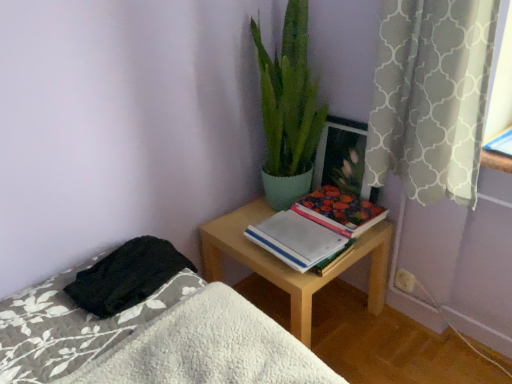
Question: From a real-world perspective, is black fuzzy blanket at lower left positioned under light wood desk at center based on gravity?

Choices:
 (A) no
 (B) yes

Answer: (A)

Question: From the image's perspective, does black fuzzy blanket at lower left appear lower than light wood desk at center?

Choices:
 (A) no
 (B) yes

Answer: (A)

Question: Considering the relative sizes of black fuzzy blanket at lower left and light wood desk at center in the image provided, is black fuzzy blanket at lower left thinner than light wood desk at center?

Choices:
 (A) no
 (B) yes

Answer: (B)

Question: Is black fuzzy blanket at lower left bigger than light wood desk at center?

Choices:
 (A) no
 (B) yes

Answer: (A)

Question: Is light wood desk at center surrounded by black fuzzy blanket at lower left?

Choices:
 (A) yes
 (B) no

Answer: (B)

Question: Is black fuzzy blanket at lower left oriented towards light wood desk at center?

Choices:
 (A) no
 (B) yes

Answer: (A)

Question: Is wooden picture frame at upper right in front of gray textured curtain at upper right?

Choices:
 (A) yes
 (B) no

Answer: (B)

Question: Are wooden picture frame at upper right and gray textured curtain at upper right far apart?

Choices:
 (A) yes
 (B) no

Answer: (B)

Question: Does wooden picture frame at upper right turn towards gray textured curtain at upper right?

Choices:
 (A) no
 (B) yes

Answer: (A)

Question: Is wooden picture frame at upper right with gray textured curtain at upper right?

Choices:
 (A) yes
 (B) no

Answer: (B)

Question: Can you confirm if wooden picture frame at upper right is thinner than gray textured curtain at upper right?

Choices:
 (A) no
 (B) yes

Answer: (B)

Question: Could gray textured curtain at upper right be considered to be inside wooden picture frame at upper right?

Choices:
 (A) yes
 (B) no

Answer: (B)

Question: Considering the relative sizes of white paper notebook at center and green matte plant at upper center in the image provided, is white paper notebook at center taller than green matte plant at upper center?

Choices:
 (A) no
 (B) yes

Answer: (A)